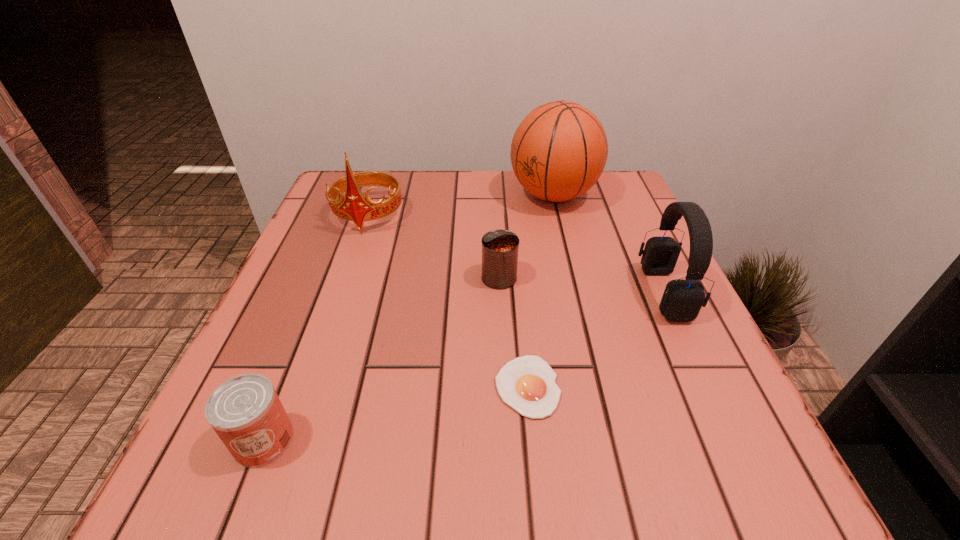
What are the coordinates of `blank area located on the headband of the rightmost object` in the screenshot? It's located at (550, 293).

The width and height of the screenshot is (960, 540). Find the location of `free space located on the headband of the rightmost object`. free space located on the headband of the rightmost object is located at coordinates (618, 293).

Locate an element on the screen. Image resolution: width=960 pixels, height=540 pixels. free spot located 0.340m on the headband of the rightmost object is located at coordinates (466, 293).

This screenshot has width=960, height=540. Find the location of `free spot located on the back of the taller can`. free spot located on the back of the taller can is located at coordinates (496, 225).

Locate an element on the screen. vacant space located on the back of the left can is located at coordinates (331, 269).

The width and height of the screenshot is (960, 540). I want to click on free space located 0.310m on the left of the egg yolk, so click(x=294, y=386).

Where is `basketball that is at the far edge`? The height and width of the screenshot is (540, 960). basketball that is at the far edge is located at coordinates (558, 152).

This screenshot has width=960, height=540. I want to click on tiara at the far edge, so click(355, 207).

Locate an element on the screen. The width and height of the screenshot is (960, 540). object that is positioned at the near edge is located at coordinates [x=246, y=413].

Find the location of a particular element. This screenshot has height=540, width=960. tiara located at the left edge is located at coordinates (355, 207).